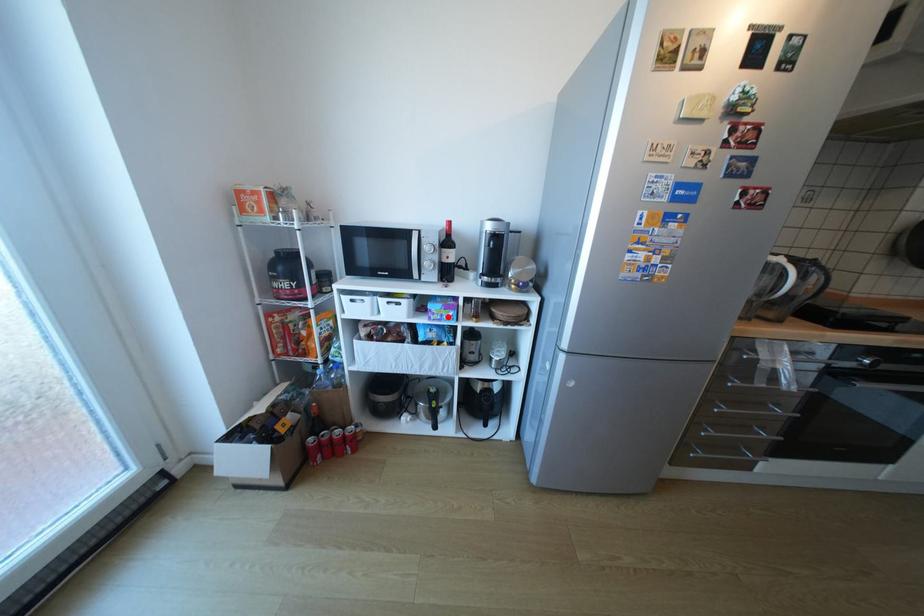
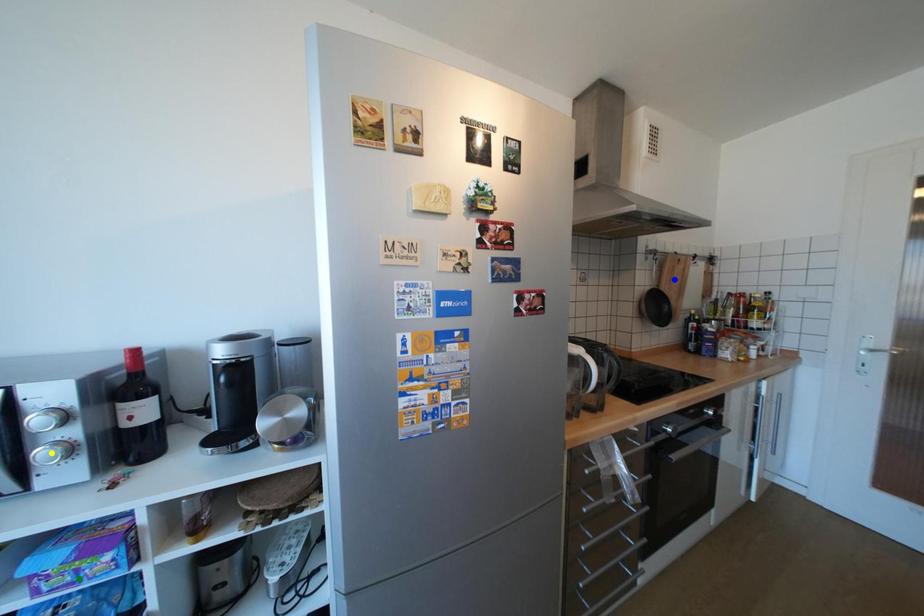
Question: I am providing you with two images of the same scene from different viewpoints. A red point is marked on the first image. You are given multiple points on the second image. Which mark in image 2 goes with the point in image 1?

Choices:
 (A) blue point
 (B) yellow point
 (C) green point

Answer: (C)